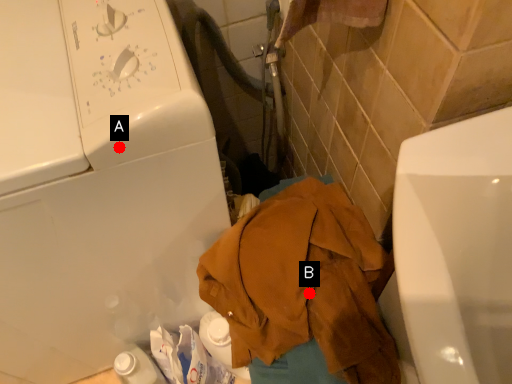
Question: Two points are circled on the image, labeled by A and B beside each circle. Which of the following is the farthest from the observer?

Choices:
 (A) A is further
 (B) B is further

Answer: (B)